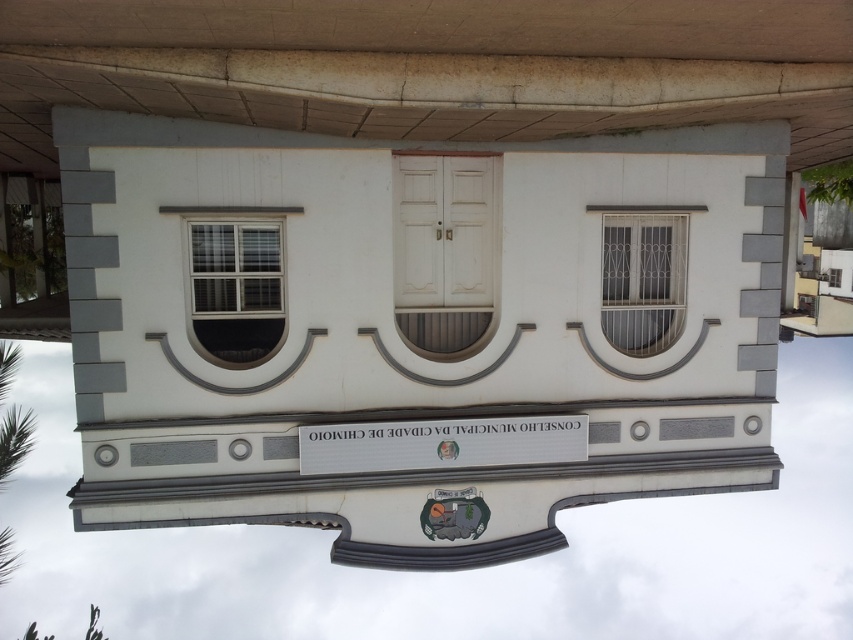
Question: Considering the real-world distances, which object is farthest from the white metal window at center?

Choices:
 (A) matte glass window at center
 (B) white plastic sign at center

Answer: (A)

Question: Which point appears closest to the camera in this image?

Choices:
 (A) (619, 316)
 (B) (302, 449)
 (C) (277, 323)

Answer: (B)

Question: Estimate the real-world distances between objects in this image. Which object is closer to the white plastic sign at center?

Choices:
 (A) white metal window at center
 (B) matte glass window at center

Answer: (B)

Question: Does matte glass window at center appear on the right side of white metal window at center?

Choices:
 (A) yes
 (B) no

Answer: (B)

Question: In this image, where is white plastic sign at center located relative to white metal window at center?

Choices:
 (A) right
 (B) left

Answer: (B)

Question: Is the position of white plastic sign at center more distant than that of white metal window at center?

Choices:
 (A) no
 (B) yes

Answer: (A)